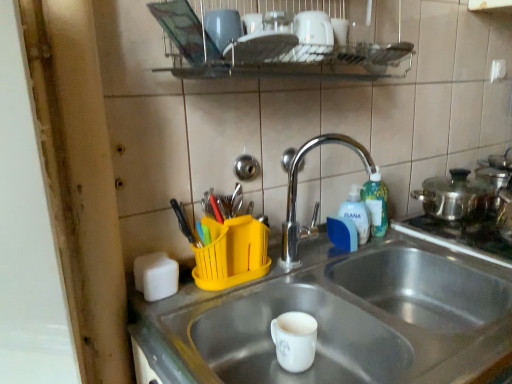
Describe the element at coordinates (271, 40) in the screenshot. I see `metallic wire rack at upper center` at that location.

This screenshot has width=512, height=384. I want to click on yellow plastic utensil holder at upper center, so click(x=226, y=242).

What do you see at coordinates (296, 187) in the screenshot? This screenshot has width=512, height=384. I see `chrome/metallic faucet at center` at bounding box center [296, 187].

I want to click on blue plastic bottle at upper right, marked as the 1th bottle in a left-to-right arrangement, so click(356, 213).

Is yellow plastic utensil holder at upper center oriented away from blue plastic bottle at upper right, which appears as the 2th bottle when viewed from the right?

yellow plastic utensil holder at upper center does not have its back to blue plastic bottle at upper right, which appears as the 2th bottle when viewed from the right.

Based on the photo, is yellow plastic utensil holder at upper center not close to blue plastic bottle at upper right, which appears as the 2th bottle when viewed from the right?

yellow plastic utensil holder at upper center is actually quite close to blue plastic bottle at upper right, which appears as the 2th bottle when viewed from the right.

Identify the location of tableware that is in front of the blue plastic bottle at upper right, marked as the 1th bottle in a left-to-right arrangement. (226, 242).

From a real-world perspective, is metallic wire rack at upper center positioned over silver metallic sink at center based on gravity?

Yes.

Are metallic wire rack at upper center and silver metallic sink at center beside each other?

No.

Does metallic wire rack at upper center have a greater height compared to silver metallic sink at center?

No.

How many degrees apart are the facing directions of metallic wire rack at upper center and silver metallic sink at center?

metallic wire rack at upper center and silver metallic sink at center are facing 1.14 degrees away from each other.

Locate an element on the screen. The height and width of the screenshot is (384, 512). bottle above the chrome/metallic faucet at center (from the image's perspective) is located at coordinates [x=376, y=203].

Looking at this image, from the image's perspective, is green translucent bottle at right, which is the second bottle in left-to-right order, below chrome/metallic faucet at center?

Incorrect, from the image's perspective, green translucent bottle at right, which is the second bottle in left-to-right order, is higher than chrome/metallic faucet at center.

Is silver metallic sink at center not close to white glossy mug at center?

No.

Which of these two, silver metallic sink at center or white glossy mug at center, is smaller?

white glossy mug at center.

At what (x,y) coordinates should I click in order to perform the action: click on sink on the right side of white glossy mug at center. Please return your answer as a coordinate pair (x, y). Looking at the image, I should click on (339, 319).

Is white glossy mug at center not close to metallic wire rack at upper center?

That's not correct — white glossy mug at center is a little close to metallic wire rack at upper center.

In terms of width, does white glossy mug at center look wider or thinner when compared to metallic wire rack at upper center?

Considering their sizes, white glossy mug at center looks slimmer than metallic wire rack at upper center.

Is white glossy mug at center at the left side of metallic wire rack at upper center?

Yes.

Is metallic wire rack at upper center positioned before white glossy mug at center?

Yes, it is.

What are the coordinates of `shelf that appears above the white glossy mug at center (from the image's perspective)` in the screenshot? It's located at (271, 40).

What's the angular difference between metallic wire rack at upper center and white glossy mug at center's facing directions?

The angular difference between metallic wire rack at upper center and white glossy mug at center is 0.964 degrees.

Is metallic wire rack at upper center bigger than white glossy mug at center?

Correct, metallic wire rack at upper center is larger in size than white glossy mug at center.

Considering the positions of point (237, 228) and point (430, 251), is point (237, 228) closer or farther from the camera than point (430, 251)?

Point (237, 228).

Locate an element on the screen. This screenshot has height=384, width=512. tableware located behind the silver metallic sink at center is located at coordinates (226, 242).

Looking at their sizes, would you say yellow plastic utensil holder at upper center is wider or thinner than silver metallic sink at center?

Clearly, yellow plastic utensil holder at upper center has less width compared to silver metallic sink at center.

Is yellow plastic utensil holder at upper center spatially inside silver metallic sink at center, or outside of it?

yellow plastic utensil holder at upper center is outside silver metallic sink at center.

The width and height of the screenshot is (512, 384). What are the coordinates of `bottle that is the 1st one when counting upward from the yellow plastic utensil holder at upper center (from the image's perspective)` in the screenshot? It's located at (356, 213).

Locate an element on the screen. The image size is (512, 384). shelf on the left of silver metallic sink at center is located at coordinates (271, 40).

Considering their positions, is white glossy mug at center positioned further to metallic wire rack at upper center than blue plastic bottle at upper right, marked as the 1th bottle in a left-to-right arrangement?

white glossy mug at center is further to metallic wire rack at upper center.

Based on their spatial positions, is chrome/metallic faucet at center or blue plastic bottle at upper right, which appears as the 2th bottle when viewed from the right, further from white glossy mug at center?

blue plastic bottle at upper right, which appears as the 2th bottle when viewed from the right.

From the picture: Estimate the real-world distances between objects in this image. Which object is closer to metallic wire rack at upper center, chrome/metallic faucet at center or silver metallic sink at center?

chrome/metallic faucet at center is positioned closer to the anchor metallic wire rack at upper center.

Looking at the image, which one is located closer to green translucent bottle at right, which is the second bottle in left-to-right order, blue plastic bottle at upper right, marked as the 1th bottle in a left-to-right arrangement, or metallic wire rack at upper center?

blue plastic bottle at upper right, marked as the 1th bottle in a left-to-right arrangement, is positioned closer to the anchor green translucent bottle at right, which is the second bottle in left-to-right order.

Estimate the real-world distances between objects in this image. Which object is further from blue plastic bottle at upper right, marked as the 1th bottle in a left-to-right arrangement, green translucent bottle at right, the 1th bottle from the right, or white glossy mug at center?

white glossy mug at center lies further to blue plastic bottle at upper right, marked as the 1th bottle in a left-to-right arrangement, than the other object.

Considering their positions, is white glossy mug at center positioned further to chrome/metallic faucet at center than metallic wire rack at upper center?

metallic wire rack at upper center.

From the image, which object appears to be farther from white glossy mug at center, green translucent bottle at right, the 1th bottle from the right, or blue plastic bottle at upper right, which appears as the 2th bottle when viewed from the right?

green translucent bottle at right, the 1th bottle from the right, lies further to white glossy mug at center than the other object.

When comparing their distances from silver metallic sink at center, does chrome/metallic faucet at center or yellow plastic utensil holder at upper center seem closer?

yellow plastic utensil holder at upper center lies closer to silver metallic sink at center than the other object.

Where is `tap between metallic wire rack at upper center and yellow plastic utensil holder at upper center in the up-down direction`? The image size is (512, 384). tap between metallic wire rack at upper center and yellow plastic utensil holder at upper center in the up-down direction is located at coordinates click(x=296, y=187).

The height and width of the screenshot is (384, 512). Find the location of `tableware between silver metallic sink at center and green translucent bottle at right, which is the second bottle in left-to-right order, in the front-back direction`. tableware between silver metallic sink at center and green translucent bottle at right, which is the second bottle in left-to-right order, in the front-back direction is located at coordinates (226, 242).

Find the location of `mug located between silver metallic sink at center and chrome/metallic faucet at center in the depth direction`. mug located between silver metallic sink at center and chrome/metallic faucet at center in the depth direction is located at coordinates (294, 340).

The image size is (512, 384). I want to click on mug located between yellow plastic utensil holder at upper center and blue plastic bottle at upper right, which appears as the 2th bottle when viewed from the right, in the left-right direction, so click(294, 340).